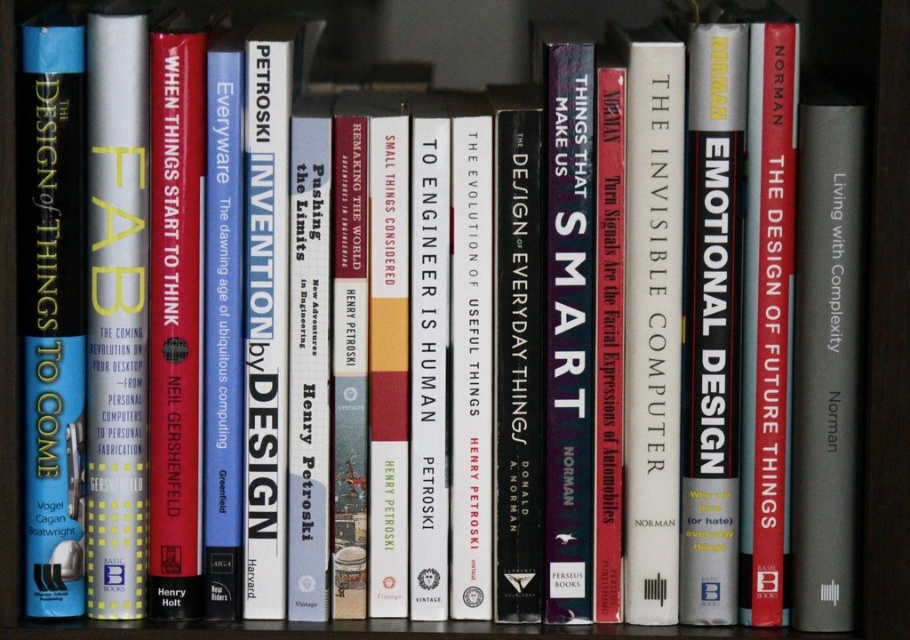
You are organizing a bookshelf and see the gray matte book at center and the red matte hardcover book at center. Which book is positioned to the right of the other?

The gray matte book at center is to the right of the red matte hardcover book at center.

You are standing in front of the bookshelf and want to reach the blue hardcover book at left. If your arm can extend 30 inches, can you reach it?

The blue hardcover book at left is 36.87 inches away from the viewer. Since your arm can only extend 30 inches, you cannot reach it without moving closer.